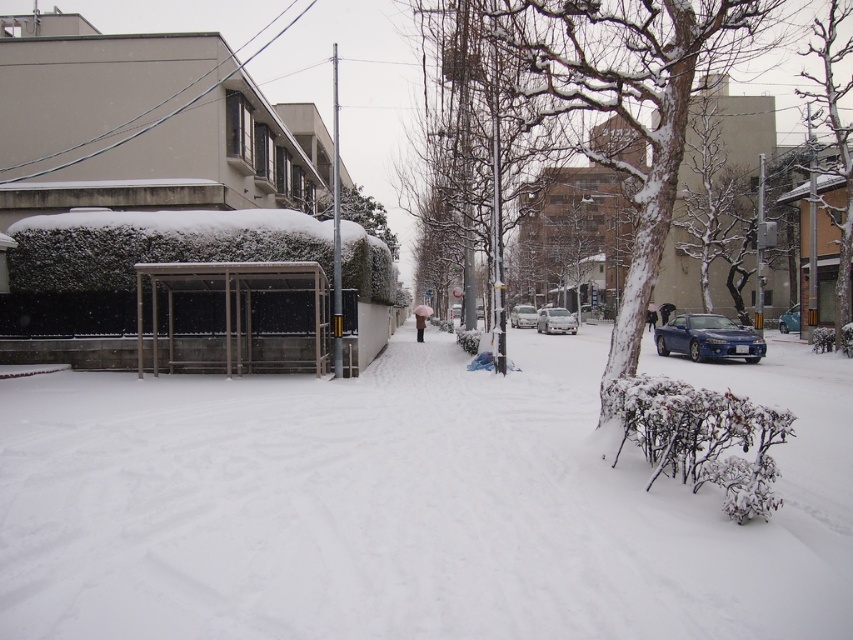
Can you confirm if white matte van at center is taller than white glossy sedan at center?

Yes.

Find the location of a particular element. white matte van at center is located at coordinates (555, 321).

The image size is (853, 640). Identify the location of white matte van at center. (555, 321).

Which is above, snow-covered tree at right or shiny blue car at center?

snow-covered tree at right

Who is more forward, (808,92) or (718,342)?

Point (718,342) is in front.

The height and width of the screenshot is (640, 853). I want to click on snow-covered tree at right, so click(x=834, y=134).

Consider the image. Does white fluffy snow at center have a smaller size compared to white matte van at center?

Incorrect, white fluffy snow at center is not smaller in size than white matte van at center.

Does point (59, 573) come in front of point (543, 332)?

That is True.

Identify the location of white fluffy snow at center. (410, 502).